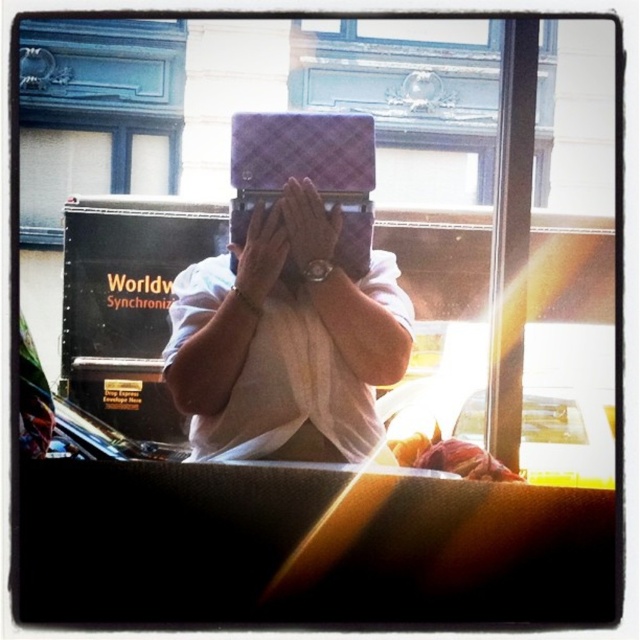
Identify the location of matte purple laptop at center. This screenshot has height=640, width=640. (308, 228).

Is matte purple laptop at center bigger than matte white hand at center?

Incorrect, matte purple laptop at center is not larger than matte white hand at center.

Measure the distance between matte purple laptop at center and camera.

The distance of matte purple laptop at center from camera is 4.06 meters.

At what (x,y) coordinates should I click in order to perform the action: click on matte purple laptop at center. Please return your answer as a coordinate pair (x, y). Looking at the image, I should click on (308, 228).